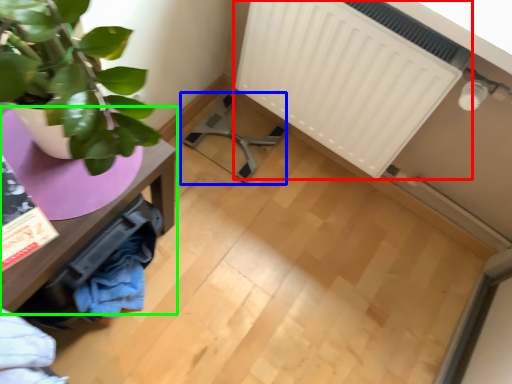
Question: Which object is the closest to the radiator (highlighted by a red box)? Choose among these: swivel chair (highlighted by a blue box) or table (highlighted by a green box).

Choices:
 (A) swivel chair
 (B) table

Answer: (A)